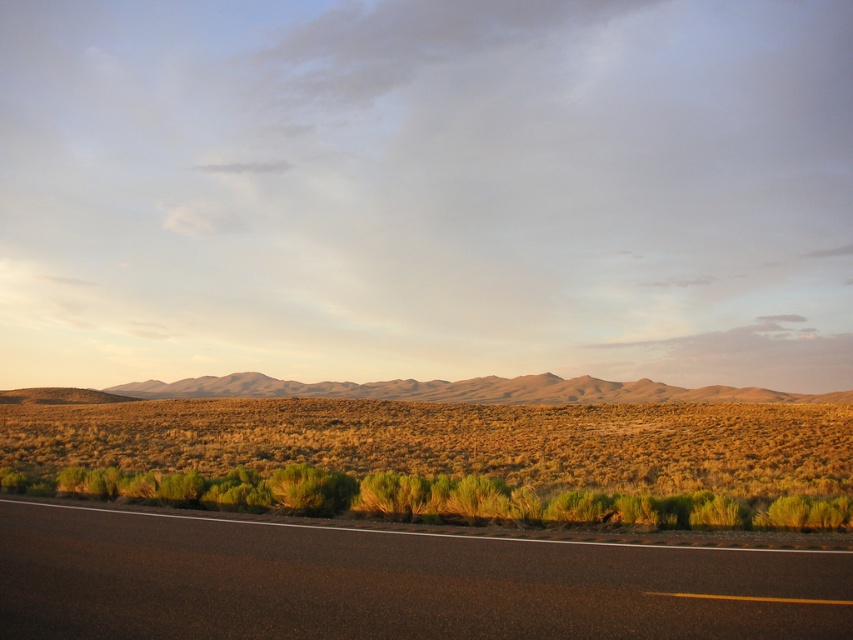
You are driving a car and see the black asphalt road at lower left and the green shrubs at lower center. Which object is positioned to the right of the other?

The green shrubs at lower center are to the right of the black asphalt road at lower left.

You are standing at the point marked by the coordinates point (445, 458) in the image. Looking around, you see the white line marking the edge of the road and the greenish yellow vegetation nearby. Which direction should you walk to reach the white line marking the edge of the road?

The point (445, 458) indicates green shrubs at lower center. To reach the white line marking the edge of the road, you should walk northward, as the road edge is positioned above the shrubs in the image.